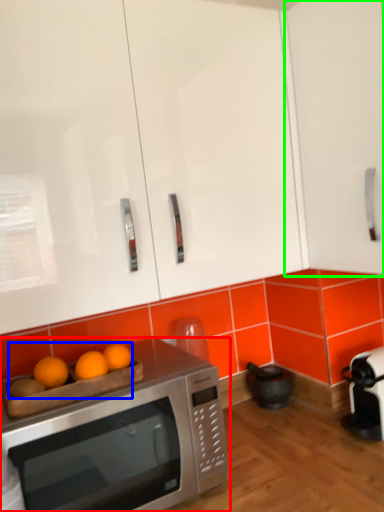
Question: Estimate the real-world distances between objects in this image. Which object is farther from microwave oven (highlighted by a red box), fruit (highlighted by a blue box) or cabinetry (highlighted by a green box)?

Choices:
 (A) fruit
 (B) cabinetry

Answer: (B)